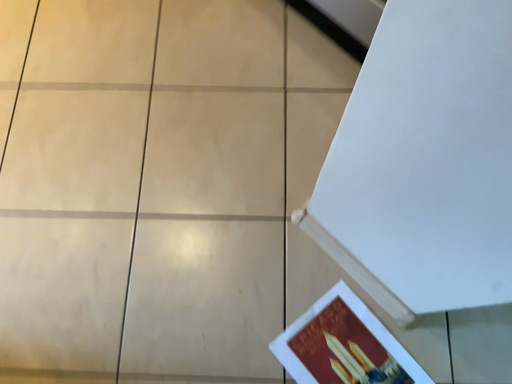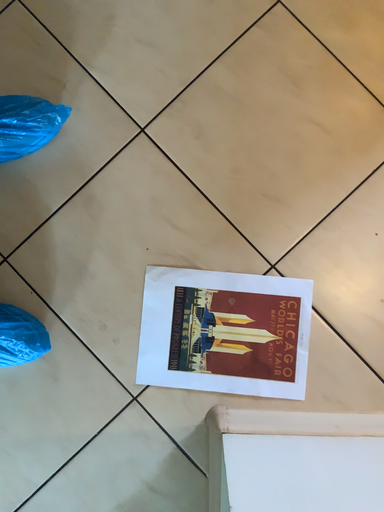
Question: Which way did the camera rotate in the video?

Choices:
 (A) rotated left
 (B) rotated right

Answer: (A)